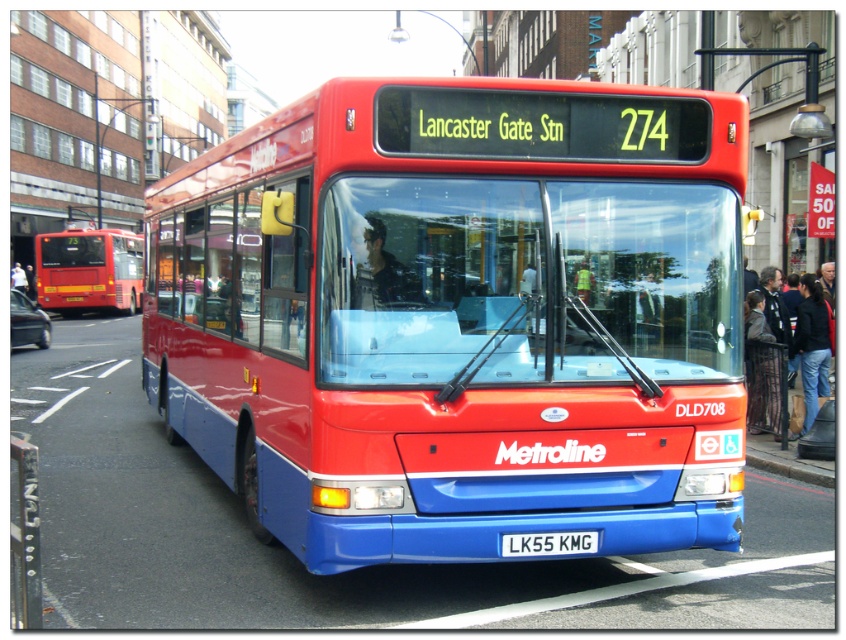
Looking at this image, you are a pedestrian standing on the sidewalk and want to cross the street where the matte red bus at left and the blue metallic license plate at center are located. Which object would you encounter first as you cross the street?

The matte red bus at left is closer to you, so you would encounter it first as you cross the street.

You are standing at the point closest to the bus. Which of the two points, point (x=88, y=228) or point (x=570, y=538), is farther away from you?

Point (x=88, y=228) is farther away from you because it is behind point (x=570, y=538).